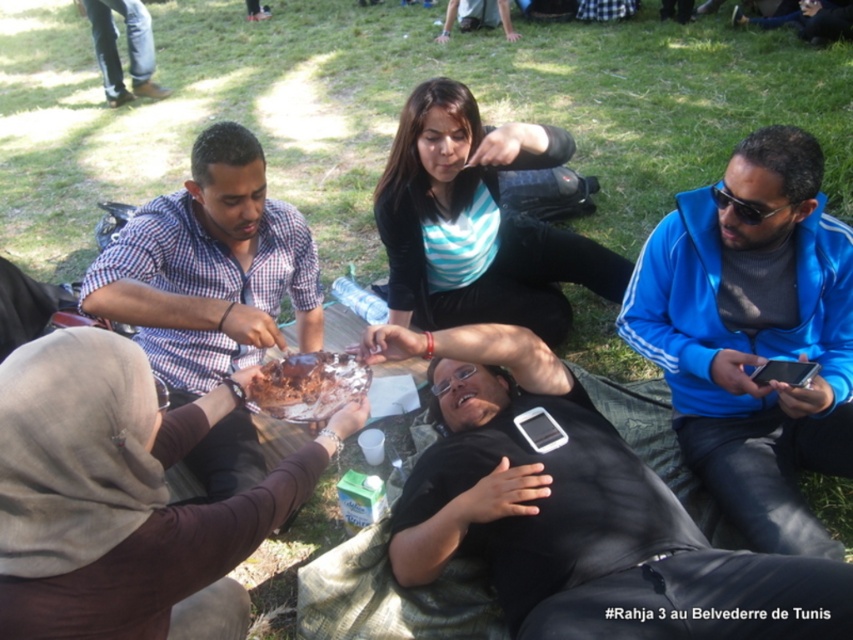
Question: Can you confirm if black matte phone at center is positioned above checkered fabric shirt at left?

Choices:
 (A) no
 (B) yes

Answer: (A)

Question: Which point is farther from the camera taking this photo?

Choices:
 (A) (13, 384)
 (B) (705, 420)
 (C) (556, 390)

Answer: (B)

Question: Among these objects, which one is farthest from the camera?

Choices:
 (A) chocolate cake at center
 (B) black matte phone at center
 (C) brown matte cake at center
 (D) blue fleece jacket at right

Answer: (A)

Question: Observing the image, what is the correct spatial positioning of blue fleece jacket at right in reference to checkered fabric shirt at left?

Choices:
 (A) above
 (B) below

Answer: (B)

Question: Which point is closer to the camera taking this photo?

Choices:
 (A) (196, 180)
 (B) (820, 294)

Answer: (B)

Question: Is black matte phone at center above blue fleece jacket at right?

Choices:
 (A) yes
 (B) no

Answer: (B)